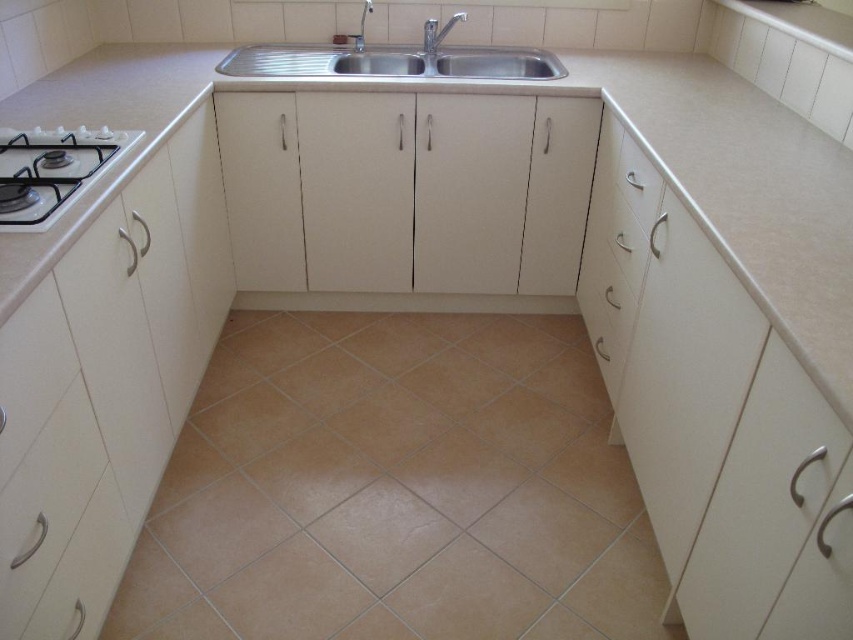
Question: Does stainless steel sink at center lie in front of satin nickel faucet at upper center?

Choices:
 (A) yes
 (B) no

Answer: (A)

Question: Which of these objects is positioned farthest from the stainless steel sink at center?

Choices:
 (A) white glossy gas stove at left
 (B) satin nickel faucet at upper center
 (C) white glossy drawer at center
 (D) silver metallic faucet at upper center

Answer: (A)

Question: Is stainless steel sink at center bigger than white glossy gas stove at left?

Choices:
 (A) no
 (B) yes

Answer: (B)

Question: Which of the following is the closest to the observer?

Choices:
 (A) (448, 28)
 (B) (627, 145)

Answer: (B)

Question: Considering the real-world distances, which object is closest to the stainless steel sink at center?

Choices:
 (A) white glossy drawer at center
 (B) white glossy gas stove at left

Answer: (A)

Question: Does stainless steel sink at center lie in front of satin nickel faucet at upper center?

Choices:
 (A) no
 (B) yes

Answer: (B)